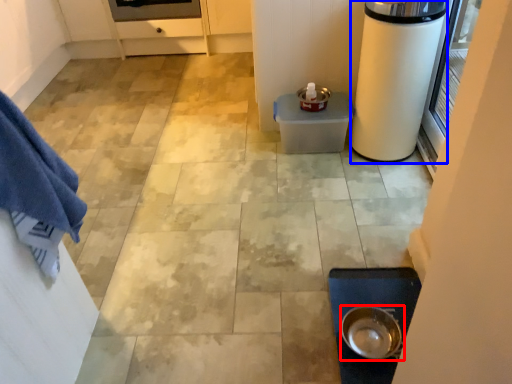
Question: Among these objects, which one is nearest to the camera, kitchen appliance (highlighted by a red box) or appliance (highlighted by a blue box)?

Choices:
 (A) kitchen appliance
 (B) appliance

Answer: (A)